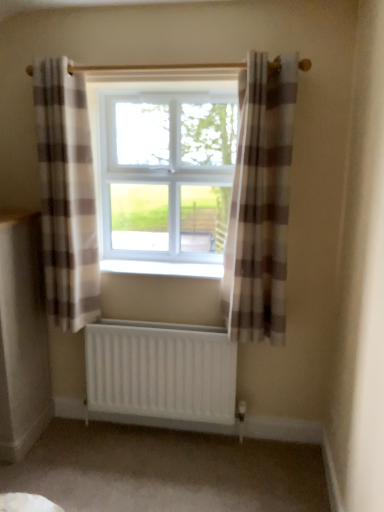
Question: In which direction should I rotate to look at plaid fabric curtain at center, which ranks as the first curtain in right-to-left order?

Choices:
 (A) left
 (B) right

Answer: (B)

Question: Is plaid fabric curtain at left, placed as the first curtain when sorted from left to right, behind white matte radiator at lower center?

Choices:
 (A) yes
 (B) no

Answer: (B)

Question: From a real-world perspective, is plaid fabric curtain at left, the 2th curtain from the right, positioned under white matte radiator at lower center based on gravity?

Choices:
 (A) yes
 (B) no

Answer: (B)

Question: Are plaid fabric curtain at left, the 2th curtain from the right, and white matte radiator at lower center beside each other?

Choices:
 (A) yes
 (B) no

Answer: (B)

Question: Does plaid fabric curtain at left, placed as the first curtain when sorted from left to right, come in front of white matte radiator at lower center?

Choices:
 (A) yes
 (B) no

Answer: (A)

Question: Is plaid fabric curtain at left, placed as the first curtain when sorted from left to right, oriented towards white matte radiator at lower center?

Choices:
 (A) no
 (B) yes

Answer: (A)

Question: From the image's perspective, is plaid fabric curtain at left, the 2th curtain from the right, under white matte radiator at lower center?

Choices:
 (A) no
 (B) yes

Answer: (A)

Question: Can you confirm if plaid fabric curtain at left, the 2th curtain from the right, is bigger than white plastic window at center?

Choices:
 (A) yes
 (B) no

Answer: (B)

Question: Is plaid fabric curtain at left, placed as the first curtain when sorted from left to right, facing towards white plastic window at center?

Choices:
 (A) yes
 (B) no

Answer: (B)

Question: Is plaid fabric curtain at left, the 2th curtain from the right, oriented away from white plastic window at center?

Choices:
 (A) no
 (B) yes

Answer: (A)

Question: From the image's perspective, is plaid fabric curtain at left, the 2th curtain from the right, located beneath white plastic window at center?

Choices:
 (A) no
 (B) yes

Answer: (B)

Question: From a real-world perspective, is plaid fabric curtain at left, placed as the first curtain when sorted from left to right, under white plastic window at center?

Choices:
 (A) yes
 (B) no

Answer: (A)

Question: Is plaid fabric curtain at left, placed as the first curtain when sorted from left to right, outside white plastic window at center?

Choices:
 (A) no
 (B) yes

Answer: (B)

Question: Is white plastic radiator at center taller than white matte radiator at lower center?

Choices:
 (A) yes
 (B) no

Answer: (B)